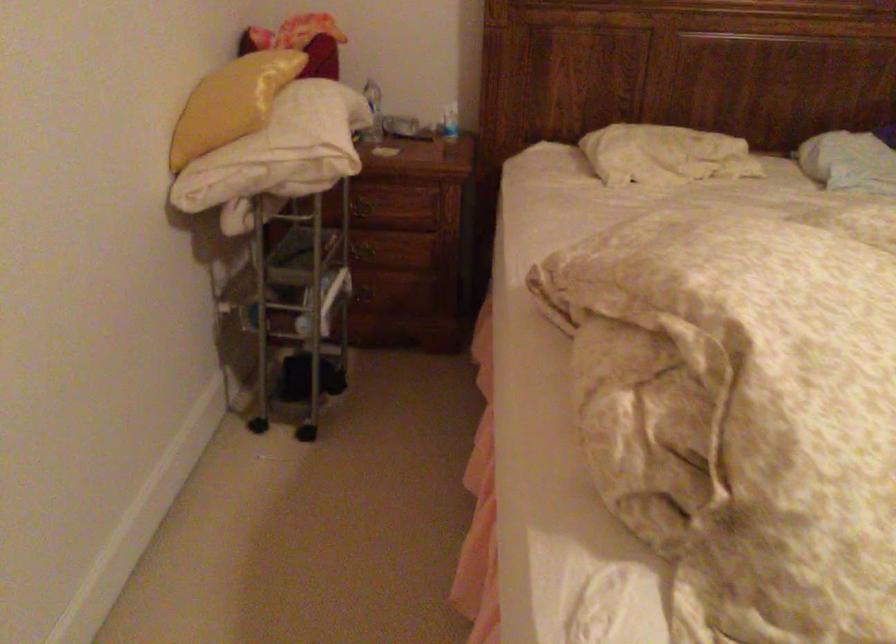
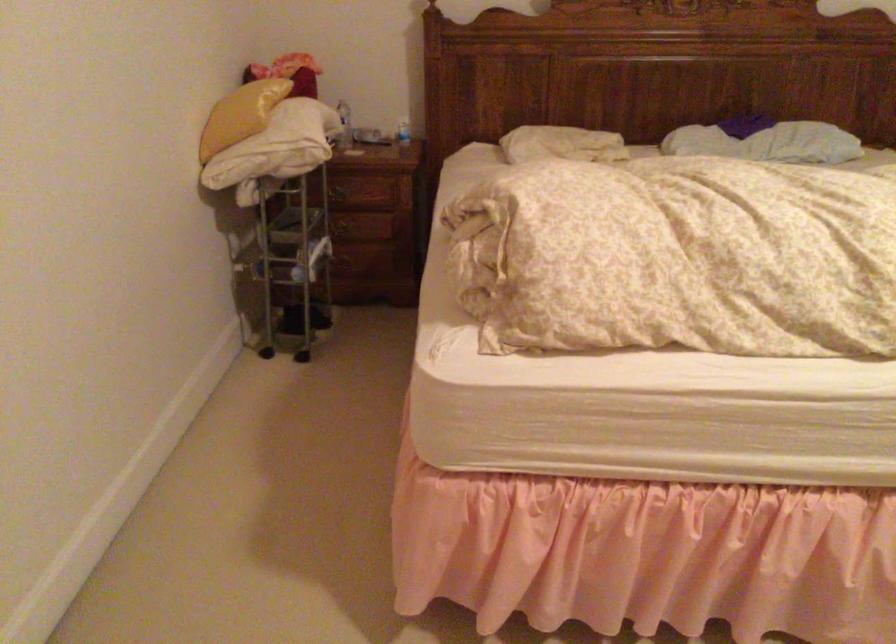
The point at (664, 160) is marked in the first image. Where is the corresponding point in the second image?

(561, 144)